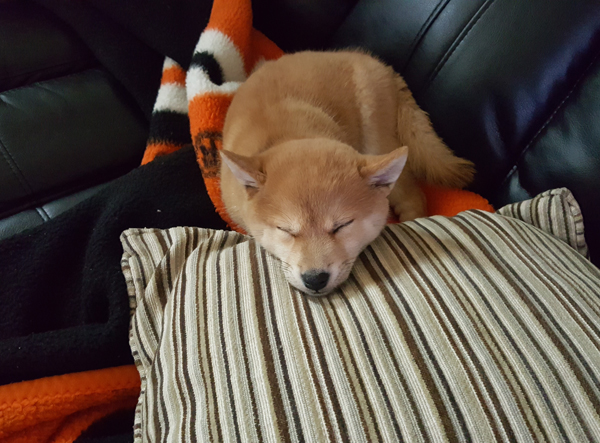
Find the location of a particular element. Image resolution: width=600 pixels, height=443 pixels. chair back is located at coordinates (475, 70).